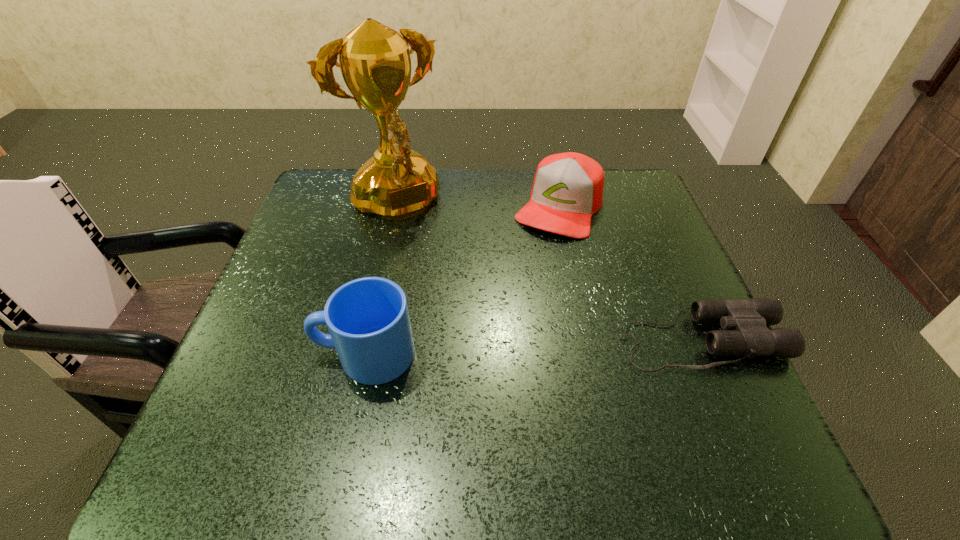
This screenshot has width=960, height=540. What are the coordinates of `vacant space positioned on the front side of the award` in the screenshot? It's located at (434, 271).

Find the location of a particular element. vacant area situated 0.360m on the front side of the award is located at coordinates (486, 347).

Identify the location of baseball cap that is at the far edge. (567, 190).

The image size is (960, 540). I want to click on award that is at the far edge, so click(x=398, y=183).

Image resolution: width=960 pixels, height=540 pixels. I want to click on object present at the near edge, so click(x=368, y=320).

At what (x,y) coordinates should I click in order to perform the action: click on mug located at the left edge. Please return your answer as a coordinate pair (x, y). This screenshot has height=540, width=960. Looking at the image, I should click on (368, 320).

Locate an element on the screen. The height and width of the screenshot is (540, 960). award located in the left edge section of the desktop is located at coordinates (398, 183).

The image size is (960, 540). I want to click on binoculars present at the right edge, so click(x=745, y=322).

I want to click on baseball cap at the right edge, so click(567, 190).

This screenshot has width=960, height=540. I want to click on object present at the far left corner, so click(398, 183).